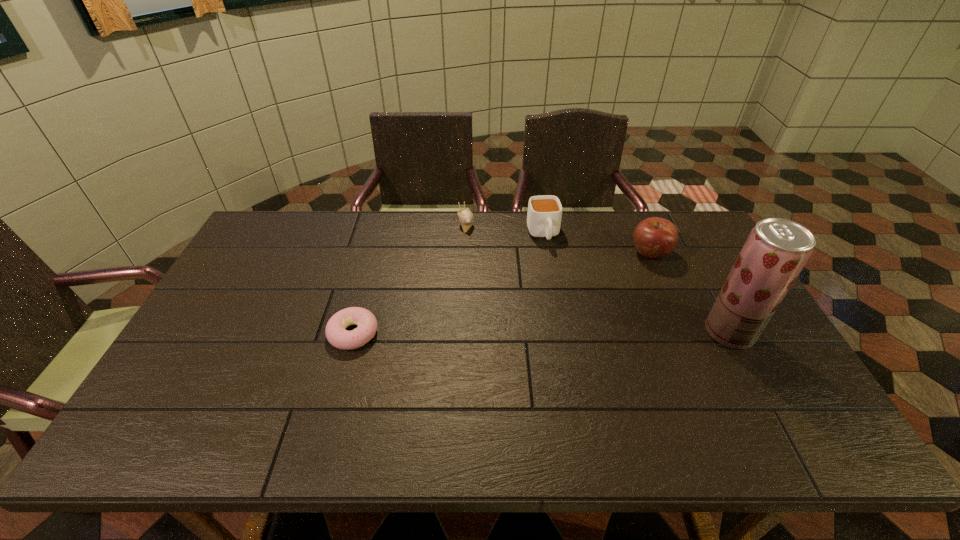
Image resolution: width=960 pixels, height=540 pixels. Identify the location of object that stands as the second closest to the cup. (654, 237).

You are a GUI agent. You are given a task and a screenshot of the screen. Output one action in this format:
    pyautogui.click(x=<x>, y=<y>)
    Task: Click on the vacant space that satisfies the following two spatial constraints: 1. on the back side of the shortest object; 2. on the left side of the third object from right to left
    
    Given the screenshot: What is the action you would take?
    pyautogui.click(x=380, y=234)

You are a GUI agent. You are given a task and a screenshot of the screen. Output one action in this format:
    pyautogui.click(x=<x>, y=<y>)
    Task: Click on the free location that satisfies the following two spatial constraints: 1. on the front side of the apple; 2. on the right side of the fruit juice
    The height and width of the screenshot is (540, 960).
    Given the screenshot: What is the action you would take?
    pyautogui.click(x=685, y=332)

At what (x,y) coordinates should I click in order to perform the action: click on vacant space that satisfies the following two spatial constraints: 1. on the front side of the apple; 2. on the right side of the fourth tallest object. Please return your answer as a coordinate pair (x, y). Image resolution: width=960 pixels, height=540 pixels. Looking at the image, I should click on (464, 253).

Locate an element on the screen. The height and width of the screenshot is (540, 960). vacant area that satisfies the following two spatial constraints: 1. on the back side of the second shortest object; 2. on the left side of the doughnut is located at coordinates (383, 221).